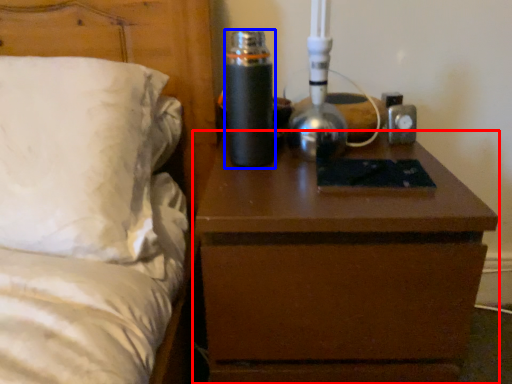
Question: Which of the following is the closest to the observer, nightstand (highlighted by a red box) or bottle (highlighted by a blue box)?

Choices:
 (A) nightstand
 (B) bottle

Answer: (A)